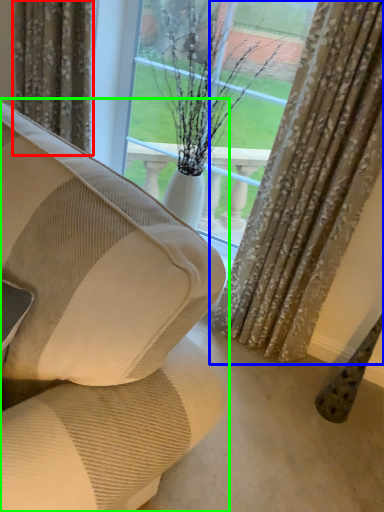
Question: Based on their relative distances, which object is nearer to curtain (highlighted by a red box)? Choose from curtain (highlighted by a blue box) and studio couch (highlighted by a green box).

Choices:
 (A) curtain
 (B) studio couch

Answer: (A)